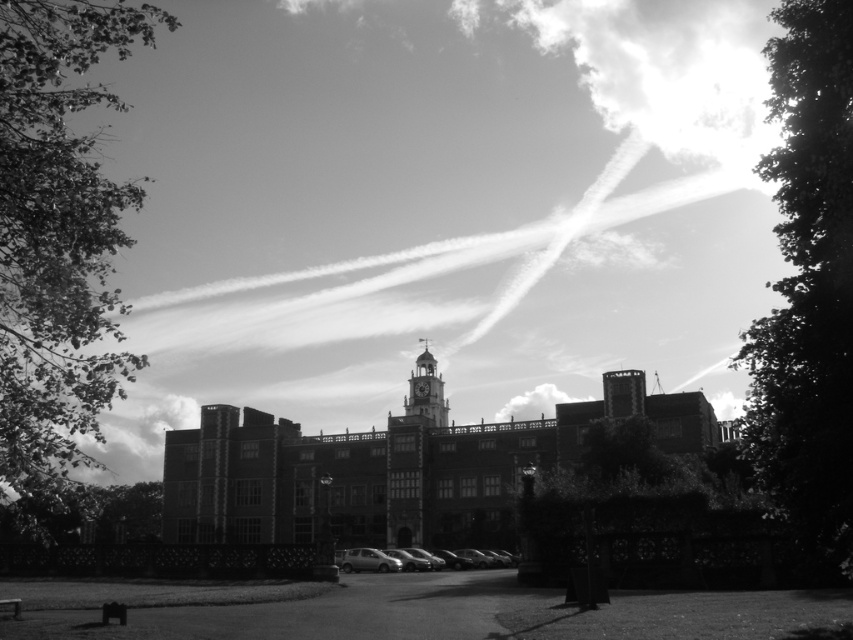
Question: Does green leafy tree at left come behind dark green leafy tree at center?

Choices:
 (A) yes
 (B) no

Answer: (B)

Question: Which point is closer to the camera taking this photo?

Choices:
 (A) (622, 500)
 (B) (416, 388)
 (C) (460, 561)
 (D) (91, 376)

Answer: (D)

Question: Is silhouette leafy tree at right smaller than dark green leafy tree at center?

Choices:
 (A) yes
 (B) no

Answer: (B)

Question: Does silhouette leafy tree at right appear on the right side of dark green leafy tree at center?

Choices:
 (A) no
 (B) yes

Answer: (B)

Question: Which point is closer to the camera?

Choices:
 (A) metallic silver car at center
 (B) green leafy tree at left
 (C) smooth stone clock tower at center

Answer: (B)

Question: Which of the following is the closest to the observer?

Choices:
 (A) (39, 387)
 (B) (418, 404)
 (C) (788, 77)
 (D) (744, 515)

Answer: (C)